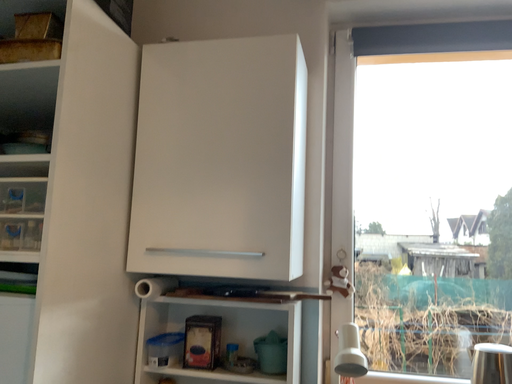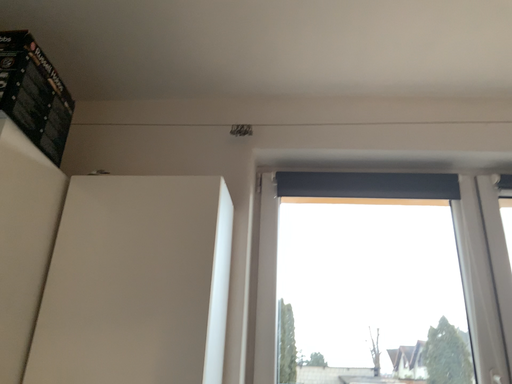
Question: How did the camera likely rotate when shooting the video?

Choices:
 (A) rotated downward
 (B) rotated upward

Answer: (B)